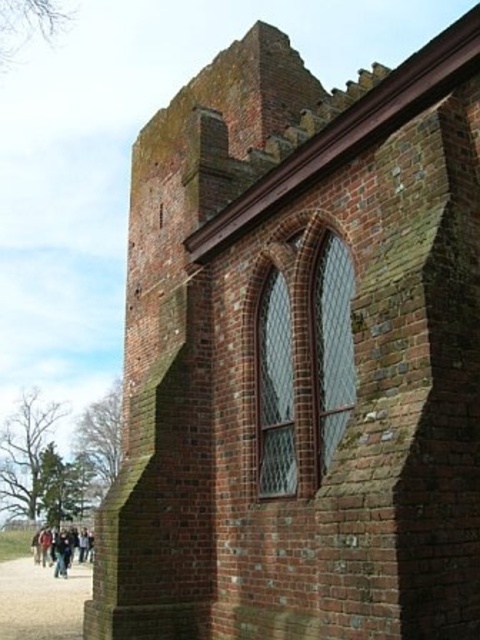
You are standing in front of the historic brick structure and notice two points marked on the wall. The first point is at coordinates point (55, 632) and the second is at point (78, 540). Which point is closer to you?

Point (55, 632) is in front of point (78, 540), so the first point is closer to you.

You are standing on the brown gravel path at lower left and want to move to the dark blue jeans at lower left. Which direction should you move to reach them?

The dark blue jeans at lower left are to the left of the brown gravel path at lower left, so you should move to the left to reach them.